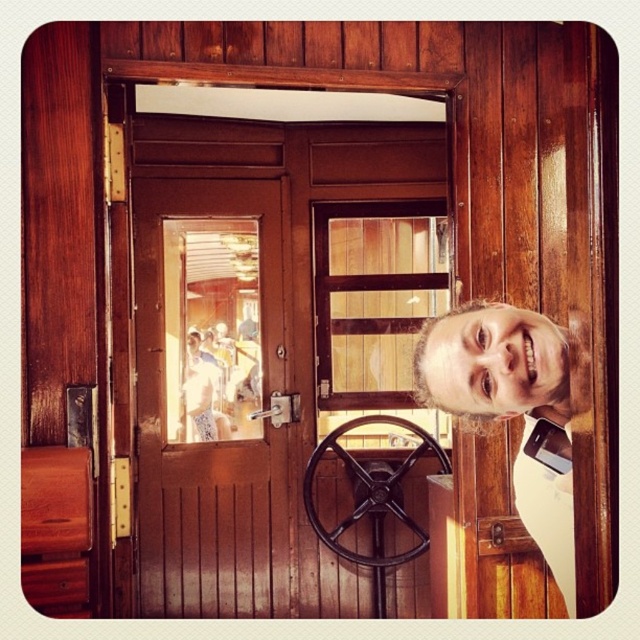
You are an observer looking at the image. There is a smooth skin face at center and a matte brown nose at center. Which object is wider?

The smooth skin face at center might be wider than the matte brown nose at center.

You are a passenger in the vintage train car and notice two features at the center of your view. The smooth skin face at center and the matte brown nose at center. Which one is more to the right?

The smooth skin face at center is positioned on the right side of matte brown nose at center, so the smooth skin face at center is more to the right.

Based on the photo, you are standing in the wooden interior of a train car and want to exit through the brown wooden door at center. If you face the door, which direction should you walk to reach it?

Since the brown wooden door at center is located at coordinates approximately 0.619 on the x and 0.330 on the y axis, you should walk forward towards the center of the room to reach it.